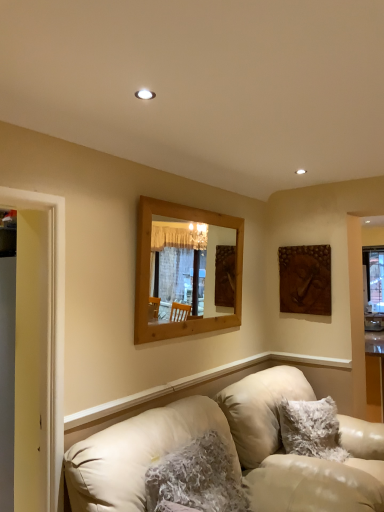
Question: Does leather couch at lower left have a greater width compared to fuzzy white pillow at lower center, which ranks as the second pillow in right-to-left order?

Choices:
 (A) yes
 (B) no

Answer: (A)

Question: From a real-world perspective, is leather couch at lower left physically above fuzzy white pillow at lower center, the second pillow from the back?

Choices:
 (A) no
 (B) yes

Answer: (A)

Question: Is leather couch at lower left to the right of fuzzy white pillow at lower center, which appears as the 1th pillow when viewed from the front, from the viewer's perspective?

Choices:
 (A) yes
 (B) no

Answer: (A)

Question: Considering the relative sizes of leather couch at lower left and fuzzy white pillow at lower center, the second pillow from the back, in the image provided, is leather couch at lower left shorter than fuzzy white pillow at lower center, the second pillow from the back,?

Choices:
 (A) yes
 (B) no

Answer: (B)

Question: From the image's perspective, would you say leather couch at lower left is positioned over fuzzy white pillow at lower center, which appears as the 1th pillow when viewed from the front?

Choices:
 (A) yes
 (B) no

Answer: (B)

Question: Is leather couch at lower left thinner than fuzzy white pillow at lower center, which ranks as the second pillow in right-to-left order?

Choices:
 (A) yes
 (B) no

Answer: (B)

Question: Is fuzzy white pillow at lower right, marked as the first pillow in a back-to-front arrangement, not inside yellow wood door frame at left?

Choices:
 (A) no
 (B) yes

Answer: (B)

Question: Is fuzzy white pillow at lower right, which is counted as the 1th pillow, starting from the right, positioned behind yellow wood door frame at left?

Choices:
 (A) no
 (B) yes

Answer: (B)

Question: Is fuzzy white pillow at lower right, which is counted as the 1th pillow, starting from the right, oriented away from yellow wood door frame at left?

Choices:
 (A) yes
 (B) no

Answer: (B)

Question: From a real-world perspective, does fuzzy white pillow at lower right, placed as the second pillow when sorted from front to back, sit lower than yellow wood door frame at left?

Choices:
 (A) no
 (B) yes

Answer: (B)

Question: Does fuzzy white pillow at lower right, which is counted as the 1th pillow, starting from the right, have a greater height compared to yellow wood door frame at left?

Choices:
 (A) no
 (B) yes

Answer: (A)

Question: Is yellow wood door frame at left a part of fuzzy white pillow at lower right, marked as the first pillow in a back-to-front arrangement?

Choices:
 (A) no
 (B) yes

Answer: (A)

Question: Does wooden mirror at center turn towards leather couch at lower left?

Choices:
 (A) yes
 (B) no

Answer: (B)